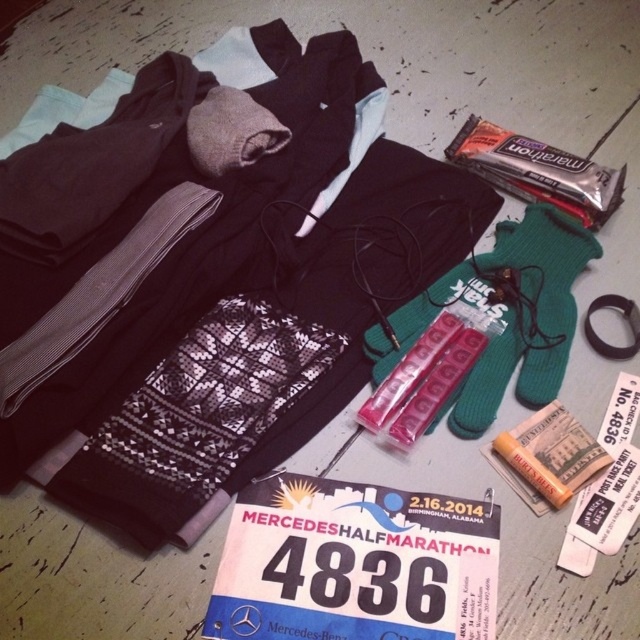
Question: Is pink plastic pill case at center below orange matte lip balm at center?

Choices:
 (A) yes
 (B) no

Answer: (B)

Question: Which point is closer to the camera?

Choices:
 (A) pink plastic blister pack at center
 (B) pink plastic pill case at center

Answer: (A)

Question: Is pink plastic blister pack at center below orange matte lip balm at center?

Choices:
 (A) no
 (B) yes

Answer: (A)

Question: Among these objects, which one is farthest from the camera?

Choices:
 (A) orange matte lip balm at center
 (B) pink plastic pill case at center

Answer: (B)

Question: Does pink plastic pill case at center appear over orange matte lip balm at center?

Choices:
 (A) yes
 (B) no

Answer: (A)

Question: Based on their relative distances, which object is farther from the pink plastic pill case at center?

Choices:
 (A) pink plastic blister pack at center
 (B) orange matte lip balm at center

Answer: (B)